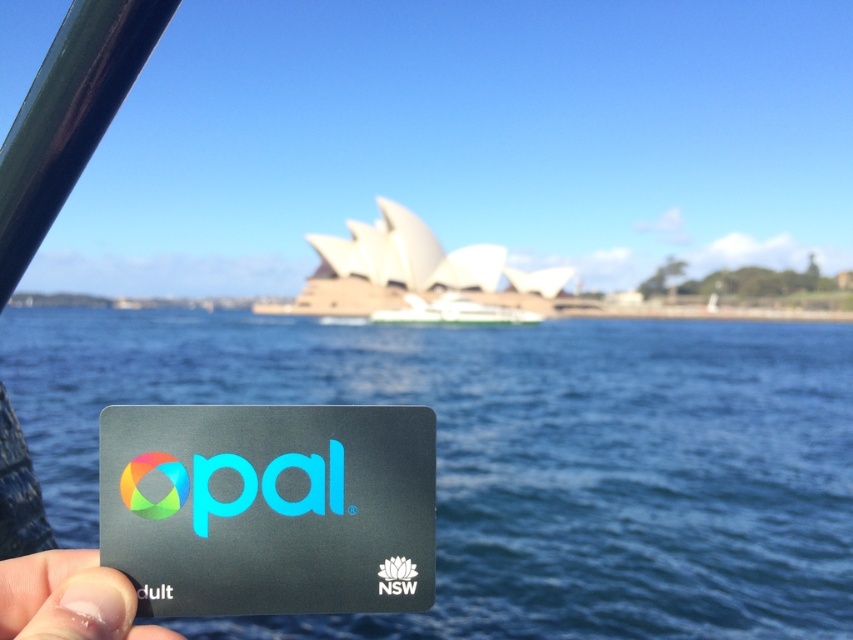
You are holding a black Opal card with your finger nail at lower left. The camera is positioned to capture the card and the Sydney Opera House in the background. If the recommended safe distance for capturing such an ID card is 15 inches, is your current position within the safe range?

The distance of finger nail at lower left from camera is 14.85 inches, which is within the recommended safe distance of 15 inches. Therefore, your current position is within the safe range.

You are holding an Opal card and want to check its details. The finger nail at lower left and the red matte nsw logo at lower center are both visible. Which one is taller?

The finger nail at lower left is taller than the red matte nsw logo at lower center.

Based on the photo, you are holding a black matte opal card at lower left and a finger nail at lower left. Which object takes up more space in the image?

The finger nail at lower left takes up more space than the black matte opal card at lower left.